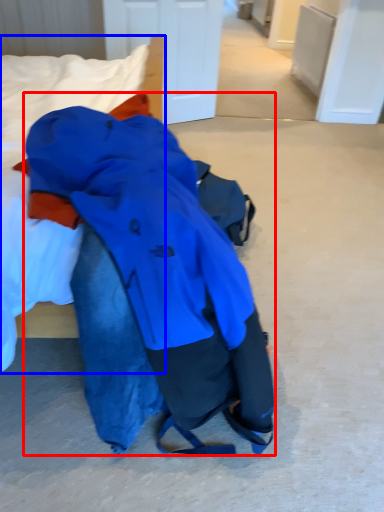
Question: Which of the following is the farthest to the observer, jacket (highlighted by a red box) or bed (highlighted by a blue box)?

Choices:
 (A) jacket
 (B) bed

Answer: (B)